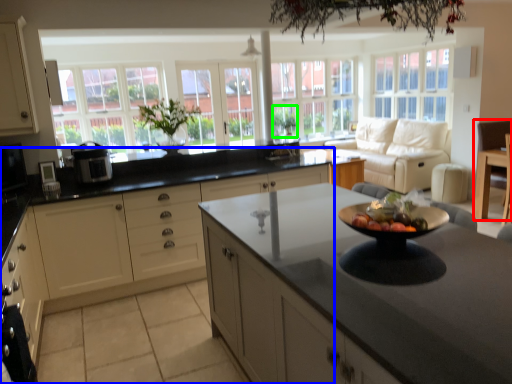
Question: Which is nearer to the armchair (highlighted by a red box)? cabinetry (highlighted by a blue box) or plant (highlighted by a green box).

Choices:
 (A) cabinetry
 (B) plant

Answer: (A)